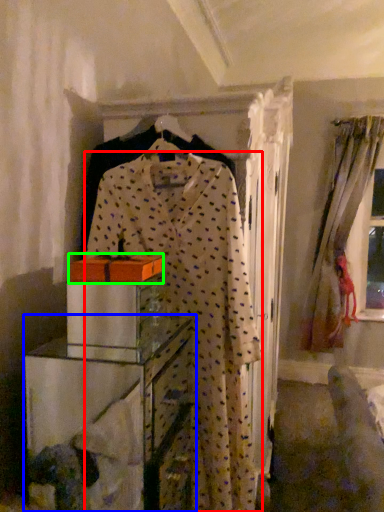
Question: Considering the real-world distances, which object is closest to fancy dress (highlighted by a red box)? furniture (highlighted by a blue box) or cardboard box (highlighted by a green box).

Choices:
 (A) furniture
 (B) cardboard box

Answer: (B)